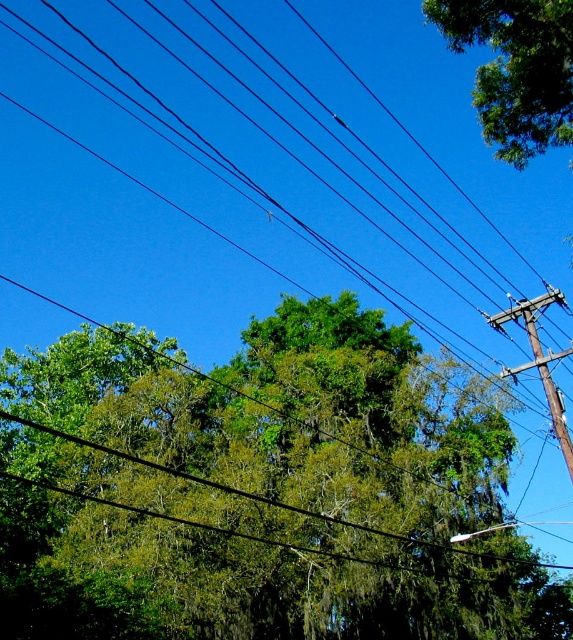
You are a bird trying to fly from the point at coordinate (x=493, y=605) to another point. The distance between these two points is 19.84 meters. Can you make it in one flap without touching the black electrical wires?

The distance between the point at coordinate (x=493, y=605) and the other point is 19.84 meters. Since birds can typically flap their wings to cover such distances without needing to touch wires, the bird can make it in one flap without touching the black electrical wires.

You are standing in a forest and want to take a photo of the green leafy tree at center. If your camera has a maximum focus range of 15 feet, will you need to move closer to the tree to get it in focus?

The green leafy tree at center is 15.56 feet away from the viewer. Since the camera can only focus up to 15 feet, you need to move closer to the tree to get it in focus.

You are a bird looking for a place to perch. You see two trees in the image, the green leafy tree at center and the green leafy tree at upper right. Which tree is located to the left of the other?

The green leafy tree at center is to the left of the green leafy tree at upper right.